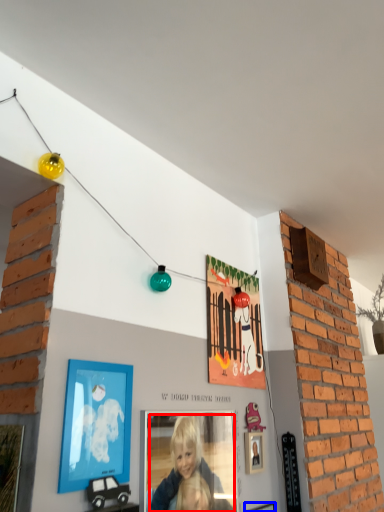
Question: Which object is closer to the camera taking this photo, person (highlighted by a red box) or picture frame (highlighted by a blue box)?

Choices:
 (A) person
 (B) picture frame

Answer: (A)